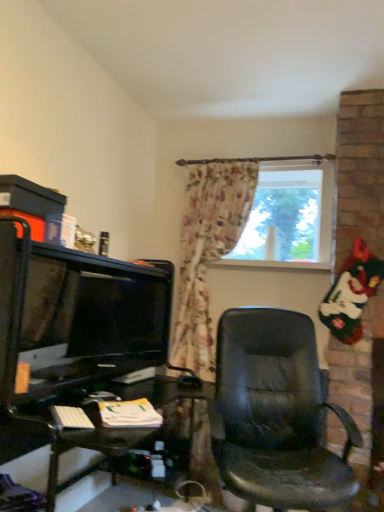
The height and width of the screenshot is (512, 384). Find the location of `matte black monitor at left`. matte black monitor at left is located at coordinates (121, 315).

The image size is (384, 512). Describe the element at coordinates (121, 315) in the screenshot. I see `matte black monitor at left` at that location.

What is the approximate width of matte black monitor at left?

matte black monitor at left is 5.07 inches wide.

What is the approximate height of matte black monitor at left?

matte black monitor at left is 17.68 inches tall.

Describe the element at coordinates (287, 217) in the screenshot. This screenshot has height=512, width=384. I see `transparent glass window at center` at that location.

Locate an element on the screen. This screenshot has height=512, width=384. transparent glass window at center is located at coordinates (287, 217).

Where is `matte black monitor at left`? Image resolution: width=384 pixels, height=512 pixels. matte black monitor at left is located at coordinates (121, 315).

Between matte black monitor at left and transparent glass window at center, which one appears on the right side from the viewer's perspective?

transparent glass window at center is more to the right.

In the scene shown: Which object is further away from the camera, matte black monitor at left or transparent glass window at center?

transparent glass window at center is more distant.

Which is behind, point (147, 353) or point (282, 234)?

The point (282, 234) is farther.

From the image's perspective, is matte black monitor at left located beneath transparent glass window at center?

Correct, matte black monitor at left appears lower than transparent glass window at center in the image.

From a real-world perspective, which is physically above, matte black monitor at left or transparent glass window at center?

transparent glass window at center, from a real-world perspective.

Which of these two, matte black monitor at left or transparent glass window at center, is wider?

With larger width is matte black monitor at left.

Based on the photo, from their relative heights in the image, would you say matte black monitor at left is taller or shorter than transparent glass window at center?

Considering their sizes, matte black monitor at left has less height than transparent glass window at center.

Considering the sizes of objects matte black monitor at left and transparent glass window at center in the image provided, who is smaller, matte black monitor at left or transparent glass window at center?

Smaller between the two is transparent glass window at center.

Is matte black monitor at left positioned beyond the bounds of transparent glass window at center?

Yes, matte black monitor at left is located beyond the bounds of transparent glass window at center.

Is matte black monitor at left directly adjacent to transparent glass window at center?

No, matte black monitor at left is not with transparent glass window at center.

Is transparent glass window at center at the back of matte black monitor at left?

No.

Identify the location of computer monitor on the left of the transparent glass window at center. Image resolution: width=384 pixels, height=512 pixels. (121, 315).

Would you say transparent glass window at center is to the left or to the right of matte black monitor at left in the picture?

Based on their positions, transparent glass window at center is located to the right of matte black monitor at left.

Who is more distant, transparent glass window at center or matte black monitor at left?

Positioned behind is transparent glass window at center.

Is point (270, 264) closer to viewer compared to point (147, 294)?

That is False.

From the image's perspective, which is above, transparent glass window at center or matte black monitor at left?

transparent glass window at center appears higher in the image.

From a real-world perspective, is transparent glass window at center below matte black monitor at left?

No, from a real-world perspective, transparent glass window at center is not under matte black monitor at left.

Is transparent glass window at center wider or thinner than matte black monitor at left?

Clearly, transparent glass window at center has less width compared to matte black monitor at left.

Considering the sizes of objects transparent glass window at center and matte black monitor at left in the image provided, who is shorter, transparent glass window at center or matte black monitor at left?

With less height is matte black monitor at left.

Based on the photo, who is bigger, transparent glass window at center or matte black monitor at left?

matte black monitor at left is bigger.

Is matte black monitor at left completely or partially inside transparent glass window at center?

No, matte black monitor at left is not a part of transparent glass window at center.

Is transparent glass window at center positioned far away from matte black monitor at left?

No, transparent glass window at center is not far from matte black monitor at left.

Is transparent glass window at center oriented towards matte black monitor at left?

No, transparent glass window at center is not facing towards matte black monitor at left.

Based on the photo, how different are the orientations of transparent glass window at center and matte black monitor at left in degrees?

The angle between the facing direction of transparent glass window at center and the facing direction of matte black monitor at left is 67.8 degrees.

Image resolution: width=384 pixels, height=512 pixels. What are the coordinates of `computer monitor below the transparent glass window at center (from a real-world perspective)` in the screenshot? It's located at (121, 315).

Image resolution: width=384 pixels, height=512 pixels. In order to click on computer monitor that is under the transparent glass window at center (from a real-world perspective) in this screenshot , I will do `click(121, 315)`.

This screenshot has height=512, width=384. I want to click on window to the right of matte black monitor at left, so click(x=287, y=217).